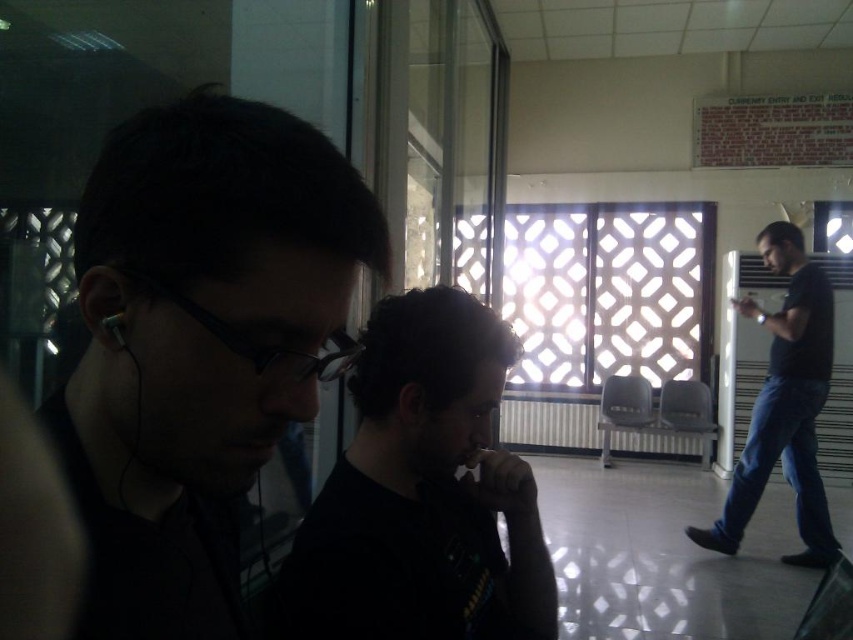
Question: Can you confirm if matte black glasses at left is positioned below black matte shirt at right?

Choices:
 (A) yes
 (B) no

Answer: (B)

Question: Is matte black glasses at left thinner than black matte shirt at right?

Choices:
 (A) yes
 (B) no

Answer: (A)

Question: Estimate the real-world distances between objects in this image. Which object is farther from the black matte shirt at center?

Choices:
 (A) matte black glasses at left
 (B) black matte earphone at left
 (C) black matte shirt at right

Answer: (C)

Question: Among these objects, which one is farthest from the camera?

Choices:
 (A) black matte shirt at right
 (B) matte black glasses at left
 (C) black matte earphone at left
 (D) black matte shirt at center

Answer: (A)

Question: In this image, where is matte black glasses at left located relative to black matte earphone at left?

Choices:
 (A) below
 (B) above

Answer: (A)

Question: Which of the following is the closest to the observer?

Choices:
 (A) (114, 387)
 (B) (114, 332)

Answer: (B)